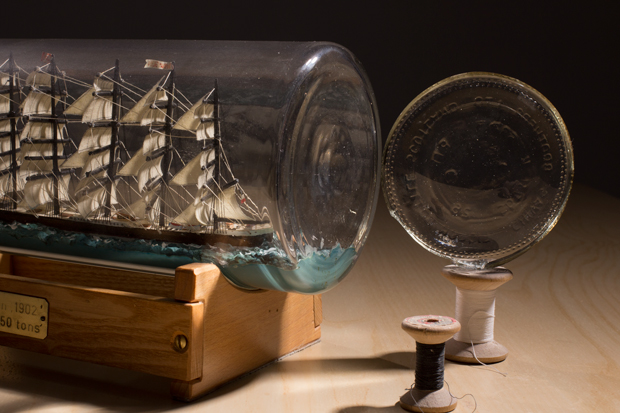
Locate an element on the screen. The width and height of the screenshot is (620, 413). brown display base is located at coordinates (240, 335).